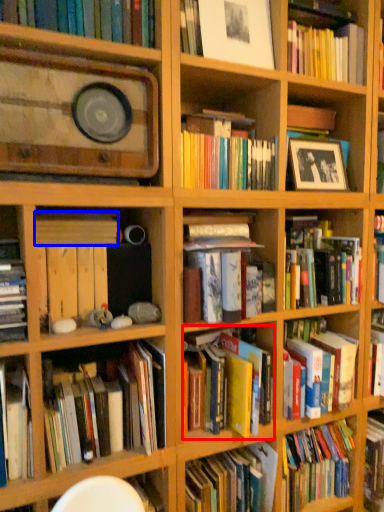
Question: Which object appears farthest to the camera in this image, book (highlighted by a red box) or book (highlighted by a blue box)?

Choices:
 (A) book
 (B) book

Answer: (A)